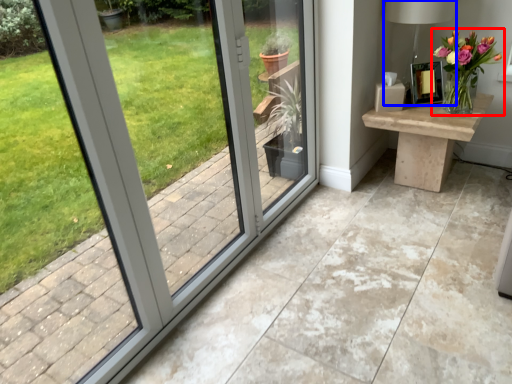
Question: Which of the following is the farthest to the observer, houseplant (highlighted by a red box) or table lamp (highlighted by a blue box)?

Choices:
 (A) houseplant
 (B) table lamp

Answer: (B)